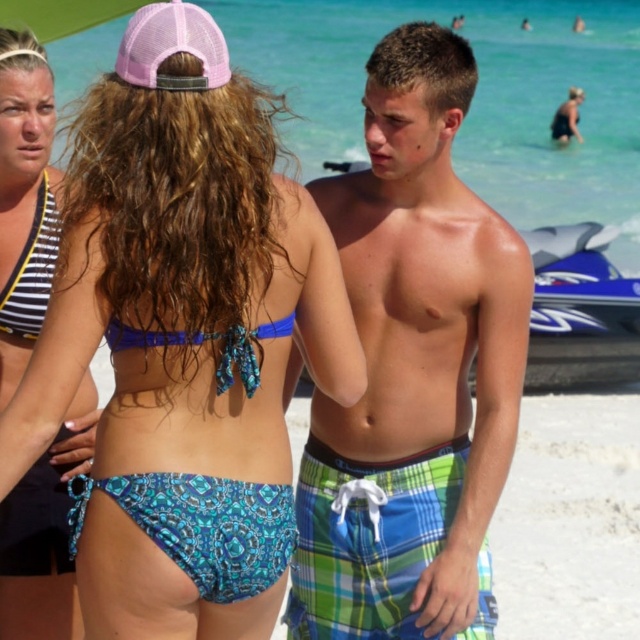
Question: Which of the following is the farthest from the observer?

Choices:
 (A) (20, 67)
 (B) (42, 273)
 (C) (237, 616)
 (D) (422, 625)

Answer: (B)

Question: Considering the relative positions of blue printed bikini bottom at center and striped fabric bikini top at left in the image provided, where is blue printed bikini bottom at center located with respect to striped fabric bikini top at left?

Choices:
 (A) below
 (B) above

Answer: (A)

Question: Which object appears closest to the camera in this image?

Choices:
 (A) green plaid shorts at center
 (B) striped fabric bikini top at upper left

Answer: (B)

Question: Which of the following is the closest to the observer?

Choices:
 (A) striped fabric bikini top at left
 (B) green plaid shorts at center
 (C) striped fabric bikini top at upper left
 (D) blue printed bikini bottom at center

Answer: (D)

Question: Is blue printed bikini bottom at center in front of striped fabric bikini top at left?

Choices:
 (A) yes
 (B) no

Answer: (A)

Question: Does blue printed bikini bottom at center appear under striped fabric bikini top at upper left?

Choices:
 (A) yes
 (B) no

Answer: (A)